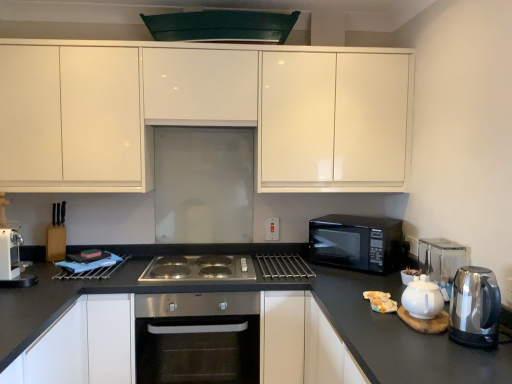
Find the location of `white glossy teapot at right`. white glossy teapot at right is located at coordinates (422, 298).

What do you see at coordinates (12, 253) in the screenshot? This screenshot has width=512, height=384. I see `white plastic coffee machine at left` at bounding box center [12, 253].

You are a GUI agent. You are given a task and a screenshot of the screen. Output one action in this format:
    pyautogui.click(x=<x>, y=<y>)
    Task: Click on the stainless steel cooktop at center
    The image size is (512, 384).
    Given the screenshot: What is the action you would take?
    199,268

In the scene shown: Between white glossy teapot at right and white plastic electric outlet at center, which one has larger size?

white glossy teapot at right.

Would you consider white glossy teapot at right to be distant from white plastic electric outlet at center?

They are positioned close to each other.

Considering the relative sizes of white glossy teapot at right and white plastic electric outlet at center in the image provided, is white glossy teapot at right taller than white plastic electric outlet at center?

Correct, white glossy teapot at right is much taller as white plastic electric outlet at center.

From the image's perspective, is white glossy teapot at right above or below white plastic electric outlet at center?

From the image's perspective, white glossy teapot at right appears below white plastic electric outlet at center.

Is stainless steel kettle at right oriented towards white plastic electric outlet at center?

No, stainless steel kettle at right is not oriented towards white plastic electric outlet at center.

Is stainless steel kettle at right further to camera compared to white plastic electric outlet at center?

No, stainless steel kettle at right is closer to the viewer.

Who is shorter, stainless steel kettle at right or white plastic electric outlet at center?

Standing shorter between the two is white plastic electric outlet at center.

Measure the distance between stainless steel kettle at right and white plastic electric outlet at center.

The distance of stainless steel kettle at right from white plastic electric outlet at center is 28.07 inches.

Can you confirm if stainless steel kettle at right is thinner than white glossy cabinet at lower left, arranged as the 1th cabinetry when ordered from the bottom?

Indeed, stainless steel kettle at right has a lesser width compared to white glossy cabinet at lower left, arranged as the 1th cabinetry when ordered from the bottom.

Does point (454, 287) appear closer or farther from the camera than point (111, 366)?

Point (454, 287).

Considering the positions of objects stainless steel kettle at right and white glossy cabinet at lower left, which is the 2th cabinetry in top-to-bottom order, in the image provided, who is more to the right, stainless steel kettle at right or white glossy cabinet at lower left, which is the 2th cabinetry in top-to-bottom order,?

stainless steel kettle at right.

Which object is more forward, stainless steel kettle at right or white glossy cabinet at lower left, which is the 2th cabinetry in top-to-bottom order?

stainless steel kettle at right.

From the picture: Is white plastic electric outlet at center inside glossy white cabinets at upper center, the 1th cabinetry positioned from the top?

No, white plastic electric outlet at center is not a part of glossy white cabinets at upper center, the 1th cabinetry positioned from the top.

Considering the sizes of glossy white cabinets at upper center, which is the 2th cabinetry in bottom-to-top order, and white plastic electric outlet at center in the image, is glossy white cabinets at upper center, which is the 2th cabinetry in bottom-to-top order, bigger or smaller than white plastic electric outlet at center?

glossy white cabinets at upper center, which is the 2th cabinetry in bottom-to-top order, is bigger than white plastic electric outlet at center.

Which point is more distant from viewer, (396, 83) or (407, 243)?

The point (407, 243) is farther from the camera.

Considering the positions of objects glossy white cabinets at upper center, the 1th cabinetry positioned from the top, and white plastic electric outlet at center in the image provided, who is more to the left, glossy white cabinets at upper center, the 1th cabinetry positioned from the top, or white plastic electric outlet at center?

glossy white cabinets at upper center, the 1th cabinetry positioned from the top.

Which is in front, white plastic coffee machine at left or stainless steel oven at center?

white plastic coffee machine at left is more forward.

Is white plastic coffee machine at left situated inside stainless steel oven at center or outside?

The correct answer is: outside.

From a real-world perspective, which object rests below the other?

stainless steel oven at center is physically lower.

Based on the photo, from the image's perspective, is white plastic coffee machine at left located above or below stainless steel cooktop at center?

Based on their image positions, white plastic coffee machine at left is located above stainless steel cooktop at center.

How many degrees apart are the facing directions of white plastic coffee machine at left and stainless steel cooktop at center?

The angle between the facing direction of white plastic coffee machine at left and the facing direction of stainless steel cooktop at center is 88 degrees.

Is white plastic coffee machine at left wider than stainless steel cooktop at center?

No, white plastic coffee machine at left is not wider than stainless steel cooktop at center.

Considering the relative positions of white plastic coffee machine at left and stainless steel cooktop at center in the image provided, is white plastic coffee machine at left to the left of stainless steel cooktop at center from the viewer's perspective?

Indeed, white plastic coffee machine at left is positioned on the left side of stainless steel cooktop at center.

How many degrees apart are the facing directions of stainless steel oven at center and glossy white cabinets at upper center, the 1th cabinetry positioned from the top?

1.43e-05 degrees separate the facing orientations of stainless steel oven at center and glossy white cabinets at upper center, the 1th cabinetry positioned from the top.

From a real-world perspective, is stainless steel oven at center located higher than glossy white cabinets at upper center, which is the 2th cabinetry in bottom-to-top order?

No, from a real-world perspective, stainless steel oven at center is not above glossy white cabinets at upper center, which is the 2th cabinetry in bottom-to-top order.

Which object is positioned more to the right, stainless steel oven at center or glossy white cabinets at upper center, the 1th cabinetry positioned from the top?

From the viewer's perspective, stainless steel oven at center appears more on the right side.

Does stainless steel oven at center have a smaller size compared to glossy white cabinets at upper center, which is the 2th cabinetry in bottom-to-top order?

Correct, stainless steel oven at center occupies less space than glossy white cabinets at upper center, which is the 2th cabinetry in bottom-to-top order.

Find the location of a particular element. This screenshot has height=384, width=512. tea pot in front of the white plastic electric outlet at center is located at coordinates (422, 298).

Identify the location of electric outlet behind the stainless steel kettle at right. (412, 245).

Based on the photo, which object lies nearer to the anchor point white plastic coffee machine at left, white plastic electric outlet at center or white glossy cabinet at lower left, which is the 2th cabinetry in top-to-bottom order?

white glossy cabinet at lower left, which is the 2th cabinetry in top-to-bottom order, is positioned closer to the anchor white plastic coffee machine at left.

Which object lies nearer to the anchor point white plastic electric outlet at center, black glossy microwave at right or white glossy teapot at right?

Among the two, black glossy microwave at right is located nearer to white plastic electric outlet at center.

From the image, which object appears to be farther from white glossy cabinet at lower left, which is the 2th cabinetry in top-to-bottom order, stainless steel kettle at right or black glossy microwave at right?

Among the two, stainless steel kettle at right is located further to white glossy cabinet at lower left, which is the 2th cabinetry in top-to-bottom order.

From the image, which object appears to be nearer to stainless steel oven at center, white plastic coffee machine at left or white glossy cabinet at lower left, which is the 2th cabinetry in top-to-bottom order?

Among the two, white glossy cabinet at lower left, which is the 2th cabinetry in top-to-bottom order, is located nearer to stainless steel oven at center.

From the picture: Looking at the image, which one is located further to stainless steel cooktop at center, white plastic coffee machine at left or stainless steel oven at center?

white plastic coffee machine at left is further to stainless steel cooktop at center.

From the image, which object appears to be nearer to stainless steel cooktop at center, stainless steel oven at center or glossy white cabinets at upper center, which is the 2th cabinetry in bottom-to-top order?

stainless steel oven at center lies closer to stainless steel cooktop at center than the other object.

Which object lies further to the anchor point stainless steel oven at center, white plastic coffee machine at left or white plastic electric outlet at center?

white plastic electric outlet at center.

In the scene shown: When comparing their distances from stainless steel kettle at right, does stainless steel cooktop at center or stainless steel oven at center seem closer?

stainless steel oven at center.

This screenshot has width=512, height=384. In order to click on electric outlet between green matte exhaust hood at upper center and stainless steel cooktop at center in the vertical direction in this screenshot , I will do `click(412, 245)`.

Find the location of a particular element. microwave oven located between white plastic coffee machine at left and stainless steel kettle at right in the left-right direction is located at coordinates (356, 242).

This screenshot has width=512, height=384. I want to click on tea pot between glossy white cabinets at upper center, the 1th cabinetry positioned from the top, and white glossy teapot at right, in the horizontal direction, so click(422, 298).

Identify the location of oven between white glossy cabinet at lower left, which is the 2th cabinetry in top-to-bottom order, and stainless steel kettle at right, in the horizontal direction. (197, 338).